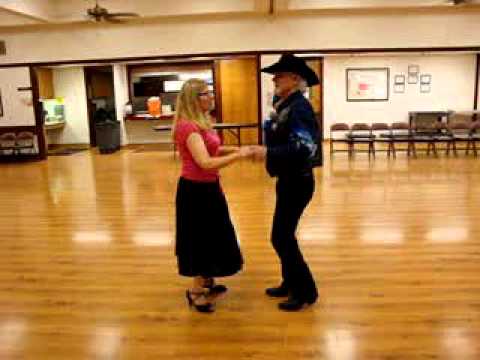
Locate an element on the screen. framed items is located at coordinates (374, 78), (414, 67), (414, 78), (425, 78), (423, 86), (400, 81), (398, 85).